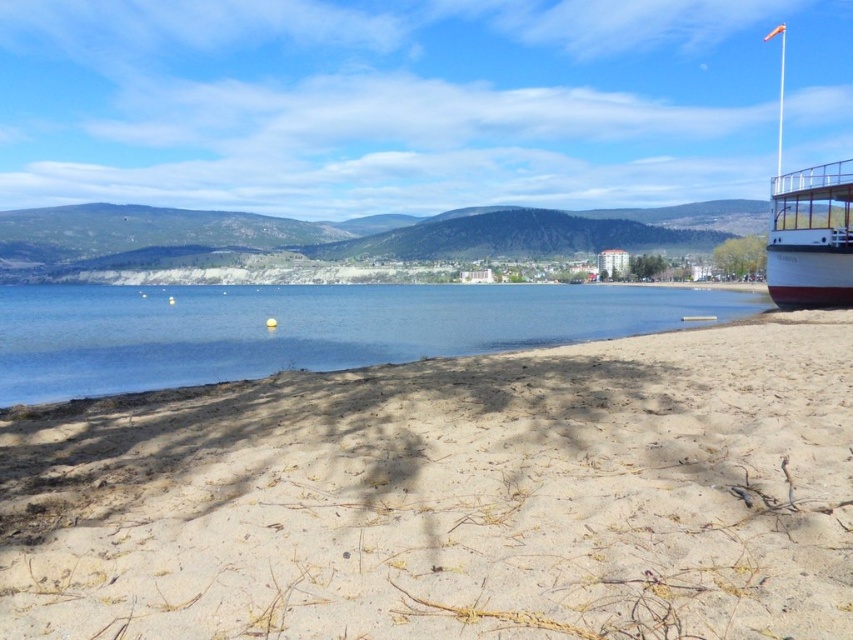
Question: Which point appears closest to the camera in this image?

Choices:
 (A) 146,291
 (B) 791,292
 (C) 544,456

Answer: (C)

Question: Observing the image, what is the correct spatial positioning of light brown sandy beach at lower center in reference to white polished wood boat at right?

Choices:
 (A) below
 (B) above

Answer: (A)

Question: Can you confirm if clear blue water at center is positioned to the left of white polished wood boat at right?

Choices:
 (A) yes
 (B) no

Answer: (A)

Question: Which object is the farthest from the white polished wood boat at right?

Choices:
 (A) light brown sandy beach at lower center
 (B) clear blue water at center

Answer: (A)

Question: Which object is the closest to the clear blue water at center?

Choices:
 (A) light brown sandy beach at lower center
 (B) white polished wood boat at right

Answer: (B)

Question: Is light brown sandy beach at lower center positioned before clear blue water at center?

Choices:
 (A) yes
 (B) no

Answer: (A)